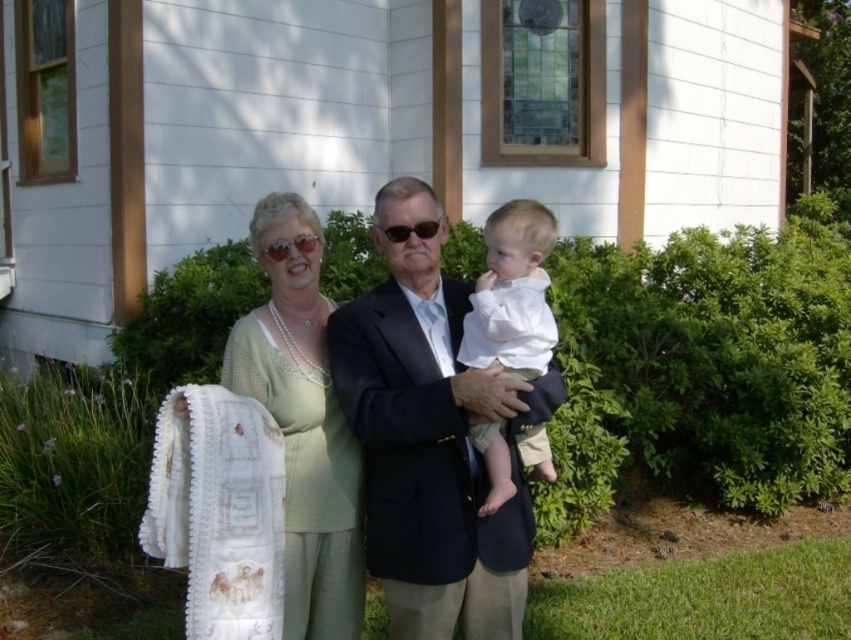
Based on the photo, you are a photographer trying to capture a family portrait. You notice the dark blue suit at center and the linen dress at center. Which clothing item is positioned higher on the person wearing it?

The dark blue suit at center is positioned higher than the linen dress at center.